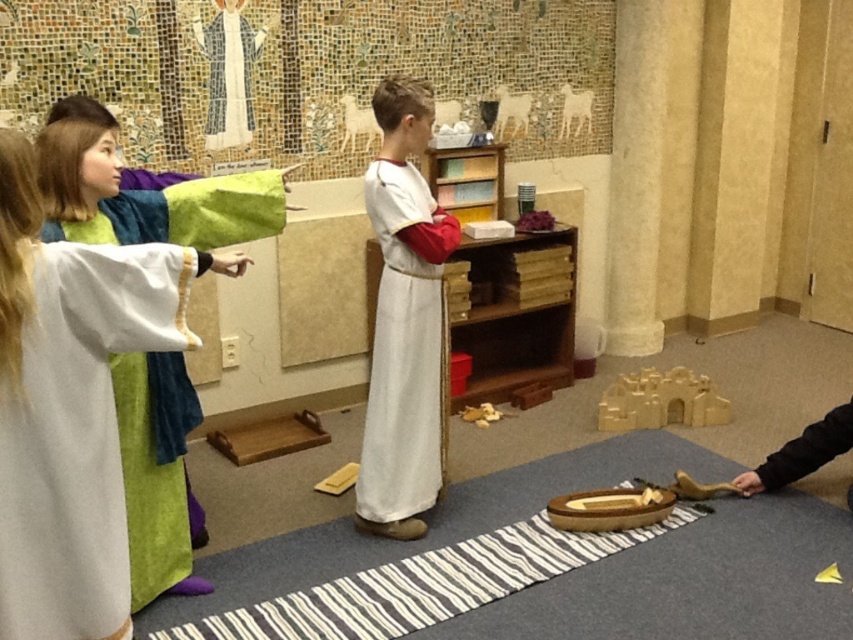
Question: Which point is closer to the camera taking this photo?

Choices:
 (A) (440, 337)
 (B) (811, 451)
 (C) (161, 364)

Answer: (C)

Question: Does white soft fabric robe at left have a larger size compared to white cotton dress at center?

Choices:
 (A) yes
 (B) no

Answer: (B)

Question: Which of the following is the closest to the observer?

Choices:
 (A) (390, 218)
 (B) (816, 458)

Answer: (A)

Question: Which object appears closest to the camera in this image?

Choices:
 (A) white cotton dress at center
 (B) white soft fabric robe at left

Answer: (B)

Question: Is white cotton dress at center to the left of black fabric robe at lower right from the viewer's perspective?

Choices:
 (A) yes
 (B) no

Answer: (A)

Question: Does white soft fabric robe at left appear over black fabric robe at lower right?

Choices:
 (A) yes
 (B) no

Answer: (A)